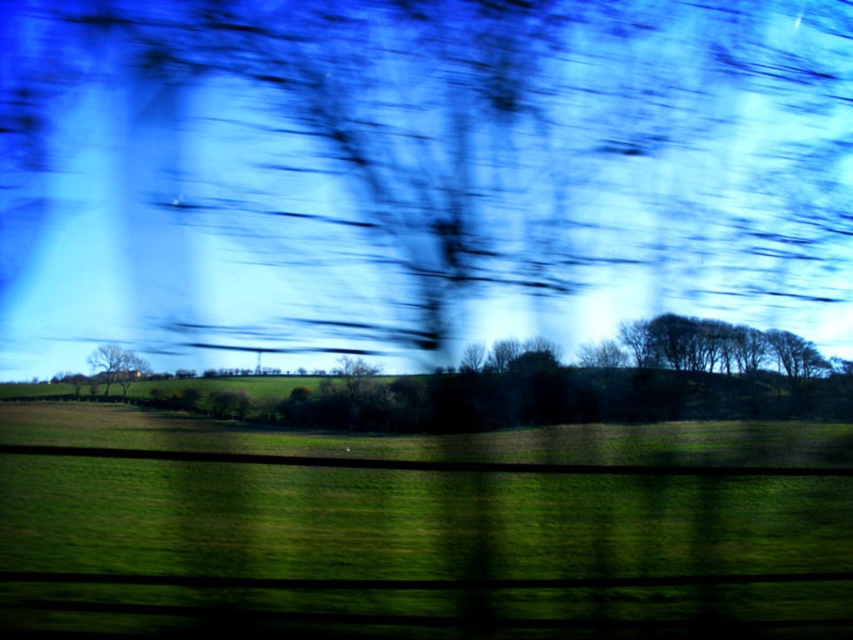
Which is more to the left, green grassy field at lower center or green matte tree at left?

Positioned to the left is green matte tree at left.

Who is more distant from viewer, (833, 554) or (102, 365)?

The point (102, 365) is more distant.

Image resolution: width=853 pixels, height=640 pixels. I want to click on green grassy field at lower center, so click(416, 528).